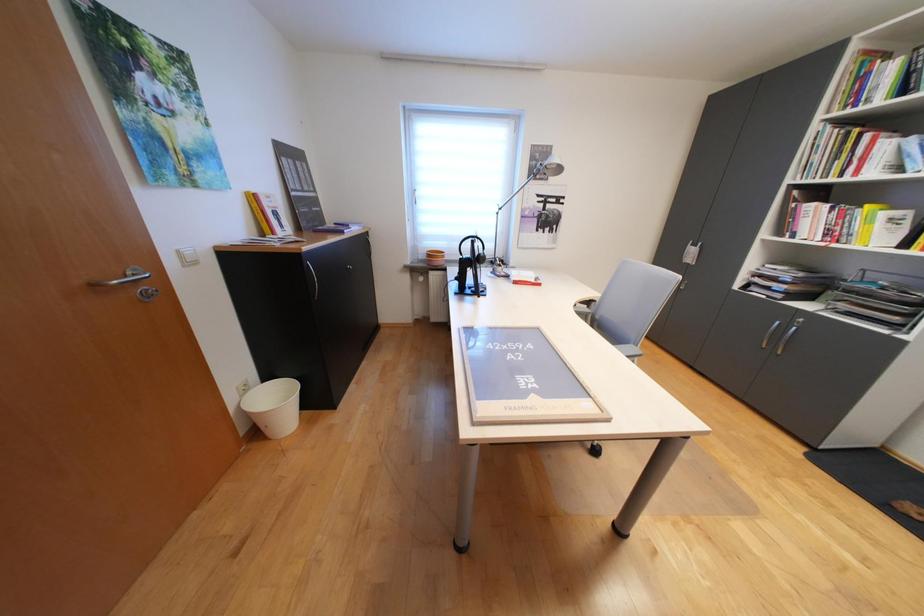
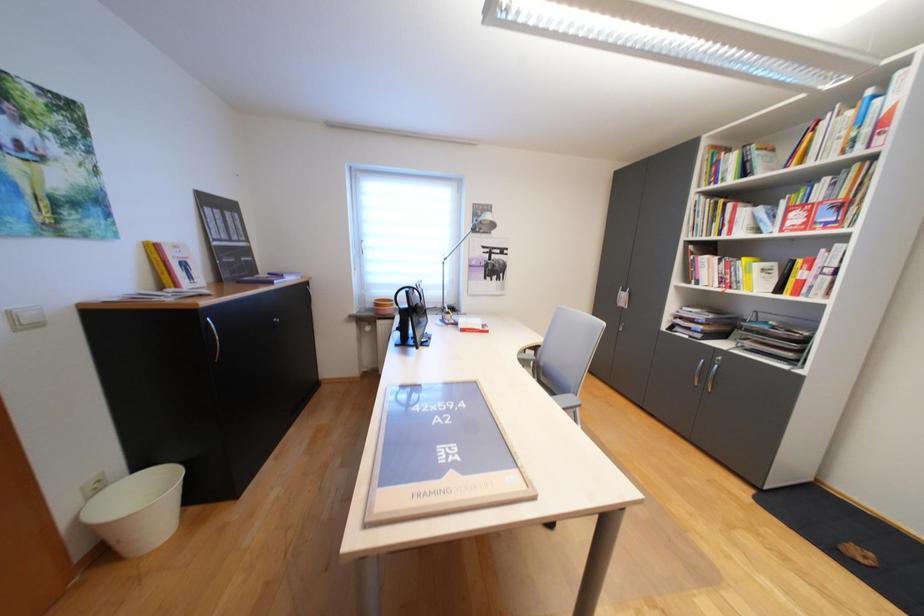
Question: The images are taken continuously from a first-person perspective. In which direction is your viewpoint rotating?

Choices:
 (A) Left
 (B) Right
 (C) Up
 (D) Down

Answer: (C)